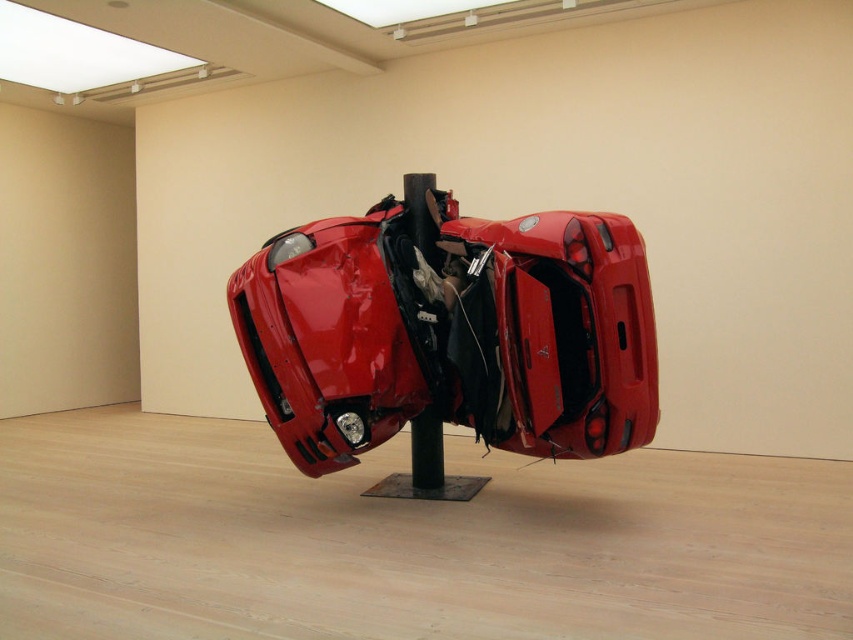
You are an art curator planning to install a new sculpture in the gallery. The sculpture requires a clear vertical space of at least 3 meters from the floor to the ceiling. Given the current installation of the glossy red car at center and the black matte pole at center, can you confirm if the available vertical space meets the sculpture requirement?

The glossy red car at center is above the black matte pole at center, but the exact height is not specified. Therefore, it is uncertain whether the vertical space meets the 3 meters requirement. You should measure the distance between the car and the ceiling to confirm.